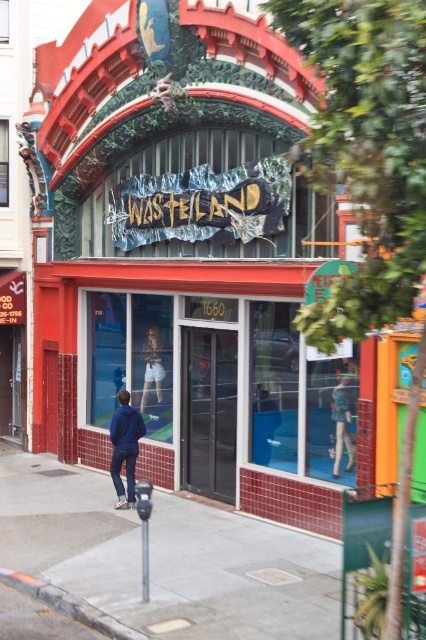
Locate an element on the screen. The width and height of the screenshot is (426, 640). matte white shorts at center is located at coordinates (152, 365).

From the picture: Does matte white shorts at center appear over metallic pole at lower center?

Indeed, matte white shorts at center is positioned over metallic pole at lower center.

Image resolution: width=426 pixels, height=640 pixels. Identify the location of matte white shorts at center. (152, 365).

Does blue denim jacket at lower left have a greater height compared to metallic pole at lower center?

Yes, blue denim jacket at lower left is taller than metallic pole at lower center.

Is point (118, 451) closer to viewer compared to point (141, 596)?

No, (118, 451) is further to viewer.

At what (x,y) coordinates should I click in order to perform the action: click on blue denim jacket at lower left. Please return your answer as a coordinate pair (x, y). The width and height of the screenshot is (426, 640). Looking at the image, I should click on (124, 448).

How far apart are gray concrete sidewalk at lower left and gray concrete curb at lower left?

A distance of 4.37 feet exists between gray concrete sidewalk at lower left and gray concrete curb at lower left.

Is the position of gray concrete sidewalk at lower left more distant than that of gray concrete curb at lower left?

No, it is in front of gray concrete curb at lower left.

Is point (287, 572) positioned behind point (63, 605)?

Yes, point (287, 572) is farther from viewer.

Find the location of a particular element. The width and height of the screenshot is (426, 640). gray concrete sidewalk at lower left is located at coordinates (160, 561).